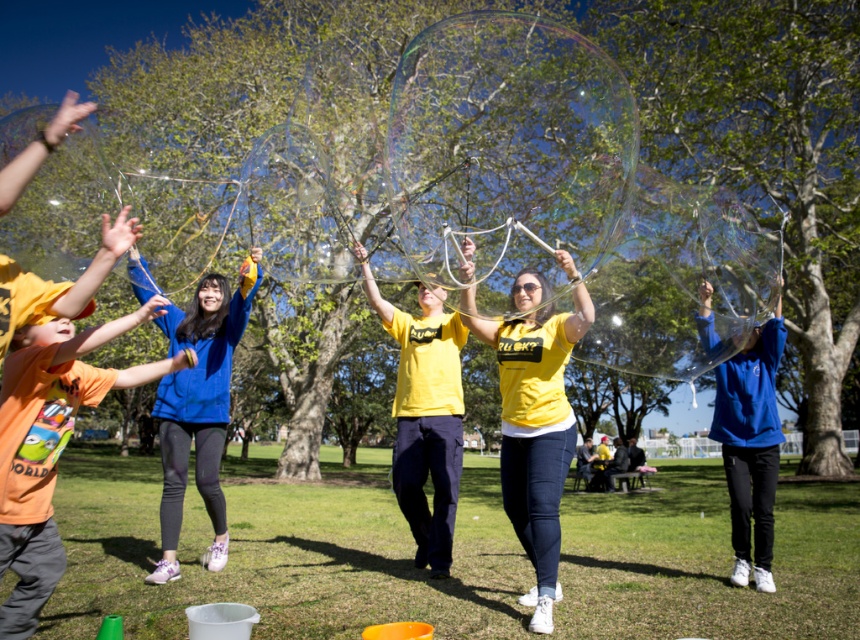
Looking at this image, between yellow matte shirt at center and blue fleece jacket at center, which one appears on the right side from the viewer's perspective?

yellow matte shirt at center

Which is above, yellow matte shirt at center or blue fleece jacket at center?

yellow matte shirt at center is higher up.

Who is more distant from viewer, [520,490] or [201,394]?

The point [201,394] is more distant.

Locate an element on the screen. The height and width of the screenshot is (640, 860). yellow matte shirt at center is located at coordinates (533, 416).

Does matte orange t-shirt at left have a greater width compared to blue fleece jacket at center?

Incorrect, matte orange t-shirt at left's width does not surpass blue fleece jacket at center's.

Which is in front, point (0, 554) or point (226, 282)?

Point (0, 554) is in front.

At what (x,y) coordinates should I click in order to perform the action: click on matte orange t-shirt at left. Please return your answer as a coordinate pair (x, y). The image size is (860, 640). Looking at the image, I should click on (50, 444).

Who is taller, matte orange t-shirt at left or yellow matte shirt at center?

With more height is yellow matte shirt at center.

Is matte orange t-shirt at left positioned in front of yellow matte shirt at center?

Yes, matte orange t-shirt at left is in front of yellow matte shirt at center.

Identify the location of matte orange t-shirt at left. This screenshot has height=640, width=860. (50, 444).